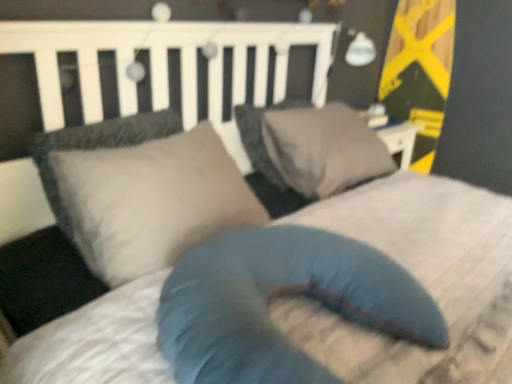
Measure the distance between point (301,133) and camera.

The distance of point (301,133) from camera is 1.66 meters.

Find the location of a particular element. Image resolution: width=512 pixels, height=384 pixels. gray fabric pillow at center, which is the first pillow in back-to-front order is located at coordinates (312, 147).

What do you see at coordinates (151, 201) in the screenshot?
I see `matte gray pillow at center, which appears as the 2th pillow when viewed from the back` at bounding box center [151, 201].

The image size is (512, 384). Identify the location of blue fabric pillow at center, the 3th pillow from the back. (281, 295).

Find the location of a particular element. gray fabric pillow at center, which appears as the third pillow when viewed from the front is located at coordinates (312, 147).

From the image's perspective, which one is positioned lower, matte gray pillow at center, which appears as the 2th pillow when viewed from the back, or blue fabric pillow at center, the 3th pillow from the back?

From the image's view, blue fabric pillow at center, the 3th pillow from the back, is below.

Consider the image. From a real-world perspective, between matte gray pillow at center, which appears as the 2th pillow when viewed from the back, and blue fabric pillow at center, which is the first pillow in front-to-back order, who is vertically lower?

blue fabric pillow at center, which is the first pillow in front-to-back order, from a real-world perspective.

Does matte gray pillow at center, the 2th pillow from the front, come behind blue fabric pillow at center, which is the first pillow in front-to-back order?

Yes.

From a real-world perspective, who is located higher, matte gray pillow at center, the 2th pillow from the front, or gray fabric pillow at center, which is the first pillow in back-to-front order?

matte gray pillow at center, the 2th pillow from the front, is physically above.

In terms of width, does matte gray pillow at center, which appears as the 2th pillow when viewed from the back, look wider or thinner when compared to gray fabric pillow at center, which is the first pillow in back-to-front order?

Clearly, matte gray pillow at center, which appears as the 2th pillow when viewed from the back, has less width compared to gray fabric pillow at center, which is the first pillow in back-to-front order.

Can you tell me how much matte gray pillow at center, which appears as the 2th pillow when viewed from the back, and gray fabric pillow at center, which appears as the third pillow when viewed from the front, differ in facing direction?

The angle between the facing direction of matte gray pillow at center, which appears as the 2th pillow when viewed from the back, and the facing direction of gray fabric pillow at center, which appears as the third pillow when viewed from the front, is 7.9e-05 degrees.

Can we say matte gray pillow at center, which appears as the 2th pillow when viewed from the back, lies outside gray fabric pillow at center, which appears as the third pillow when viewed from the front?

Indeed, matte gray pillow at center, which appears as the 2th pillow when viewed from the back, is completely outside gray fabric pillow at center, which appears as the third pillow when viewed from the front.

From the image's perspective, which is below, gray fabric pillow at center, which appears as the third pillow when viewed from the front, or blue fabric pillow at center, which is the first pillow in front-to-back order?

blue fabric pillow at center, which is the first pillow in front-to-back order, from the image's perspective.

From a real-world perspective, is gray fabric pillow at center, which is the first pillow in back-to-front order, physically above blue fabric pillow at center, the 3th pillow from the back?

Yes, from a real-world perspective, gray fabric pillow at center, which is the first pillow in back-to-front order, is above blue fabric pillow at center, the 3th pillow from the back.

Does gray fabric pillow at center, which appears as the third pillow when viewed from the front, have a lesser width compared to blue fabric pillow at center, which is the first pillow in front-to-back order?

Yes.

Consider the image. Can you tell me how much gray fabric pillow at center, which is the first pillow in back-to-front order, and blue fabric pillow at center, which is the first pillow in front-to-back order, differ in facing direction?

1.46 degrees separate the facing orientations of gray fabric pillow at center, which is the first pillow in back-to-front order, and blue fabric pillow at center, which is the first pillow in front-to-back order.

Is blue fabric pillow at center, the 3th pillow from the back, facing away from matte gray pillow at center, which appears as the 2th pillow when viewed from the back?

Yes.

From a real-world perspective, is blue fabric pillow at center, which is the first pillow in front-to-back order, located beneath matte gray pillow at center, which appears as the 2th pillow when viewed from the back?

Correct, in the physical world, blue fabric pillow at center, which is the first pillow in front-to-back order, is lower than matte gray pillow at center, which appears as the 2th pillow when viewed from the back.

Considering the relative sizes of blue fabric pillow at center, which is the first pillow in front-to-back order, and matte gray pillow at center, the 2th pillow from the front, in the image provided, is blue fabric pillow at center, which is the first pillow in front-to-back order, shorter than matte gray pillow at center, the 2th pillow from the front,?

Yes, blue fabric pillow at center, which is the first pillow in front-to-back order, is shorter than matte gray pillow at center, the 2th pillow from the front.

Is point (385, 255) positioned after point (132, 237)?

Yes, point (385, 255) is behind point (132, 237).

Is gray fabric pillow at center, which is the first pillow in back-to-front order, inside blue fabric pillow at center, which is the first pillow in front-to-back order?

That's incorrect, gray fabric pillow at center, which is the first pillow in back-to-front order, is not inside blue fabric pillow at center, which is the first pillow in front-to-back order.

Is point (396, 296) closer or farther from the camera than point (359, 145)?

Point (396, 296) is positioned closer to the camera compared to point (359, 145).

In terms of width, does blue fabric pillow at center, the 3th pillow from the back, look wider or thinner when compared to gray fabric pillow at center, which appears as the third pillow when viewed from the front?

In the image, blue fabric pillow at center, the 3th pillow from the back, appears to be wider than gray fabric pillow at center, which appears as the third pillow when viewed from the front.

From the image's perspective, is blue fabric pillow at center, the 3th pillow from the back, located above or below gray fabric pillow at center, which is the first pillow in back-to-front order?

blue fabric pillow at center, the 3th pillow from the back, is below gray fabric pillow at center, which is the first pillow in back-to-front order.

Is gray fabric pillow at center, which appears as the third pillow when viewed from the front, wider than matte gray pillow at center, which appears as the 2th pillow when viewed from the back?

Correct, the width of gray fabric pillow at center, which appears as the third pillow when viewed from the front, exceeds that of matte gray pillow at center, which appears as the 2th pillow when viewed from the back.

Is gray fabric pillow at center, which is the first pillow in back-to-front order, aimed at matte gray pillow at center, the 2th pillow from the front?

No, gray fabric pillow at center, which is the first pillow in back-to-front order, is not aimed at matte gray pillow at center, the 2th pillow from the front.

Looking at this image, is the depth of gray fabric pillow at center, which appears as the third pillow when viewed from the front, less than that of matte gray pillow at center, which appears as the 2th pillow when viewed from the back?

No, it is not.

From a real-world perspective, starting from the blue fabric pillow at center, which is the first pillow in front-to-back order, which pillow is the 2nd one vertically above it? Please provide its 2D coordinates.

[(151, 201)]

There is a matte gray pillow at center, the 2th pillow from the front. Where is `the 1st pillow below it (from a real-world perspective)`? This screenshot has height=384, width=512. the 1st pillow below it (from a real-world perspective) is located at coordinates (312, 147).

Looking at the image, which one is located further to gray fabric pillow at center, which is the first pillow in back-to-front order, blue fabric pillow at center, which is the first pillow in front-to-back order, or matte gray pillow at center, the 2th pillow from the front?

blue fabric pillow at center, which is the first pillow in front-to-back order, lies further to gray fabric pillow at center, which is the first pillow in back-to-front order, than the other object.

From the image, which object appears to be farther from matte gray pillow at center, which appears as the 2th pillow when viewed from the back, gray fabric pillow at center, which appears as the third pillow when viewed from the front, or blue fabric pillow at center, the 3th pillow from the back?

gray fabric pillow at center, which appears as the third pillow when viewed from the front, lies further to matte gray pillow at center, which appears as the 2th pillow when viewed from the back, than the other object.

Considering their positions, is matte gray pillow at center, which appears as the 2th pillow when viewed from the back, positioned further to gray fabric pillow at center, which is the first pillow in back-to-front order, than blue fabric pillow at center, which is the first pillow in front-to-back order?

blue fabric pillow at center, which is the first pillow in front-to-back order.

Looking at the image, which one is located closer to blue fabric pillow at center, which is the first pillow in front-to-back order, gray fabric pillow at center, which is the first pillow in back-to-front order, or matte gray pillow at center, the 2th pillow from the front?

matte gray pillow at center, the 2th pillow from the front, lies closer to blue fabric pillow at center, which is the first pillow in front-to-back order, than the other object.

Based on their spatial positions, is matte gray pillow at center, which appears as the 2th pillow when viewed from the back, or gray fabric pillow at center, which is the first pillow in back-to-front order, further from blue fabric pillow at center, which is the first pillow in front-to-back order?

gray fabric pillow at center, which is the first pillow in back-to-front order, is further to blue fabric pillow at center, which is the first pillow in front-to-back order.

Based on their spatial positions, is blue fabric pillow at center, which is the first pillow in front-to-back order, or gray fabric pillow at center, which is the first pillow in back-to-front order, closer to matte gray pillow at center, which appears as the 2th pillow when viewed from the back?

blue fabric pillow at center, which is the first pillow in front-to-back order, is positioned closer to the anchor matte gray pillow at center, which appears as the 2th pillow when viewed from the back.

At what (x,y) coordinates should I click in order to perform the action: click on pillow located between blue fabric pillow at center, the 3th pillow from the back, and gray fabric pillow at center, which is the first pillow in back-to-front order, in the depth direction. Please return your answer as a coordinate pair (x, y). The image size is (512, 384). Looking at the image, I should click on (151, 201).